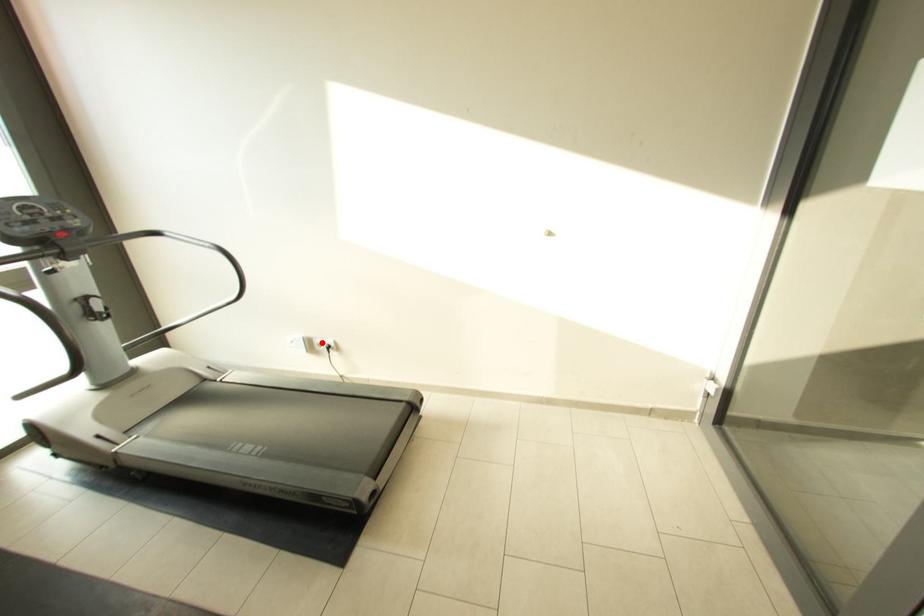
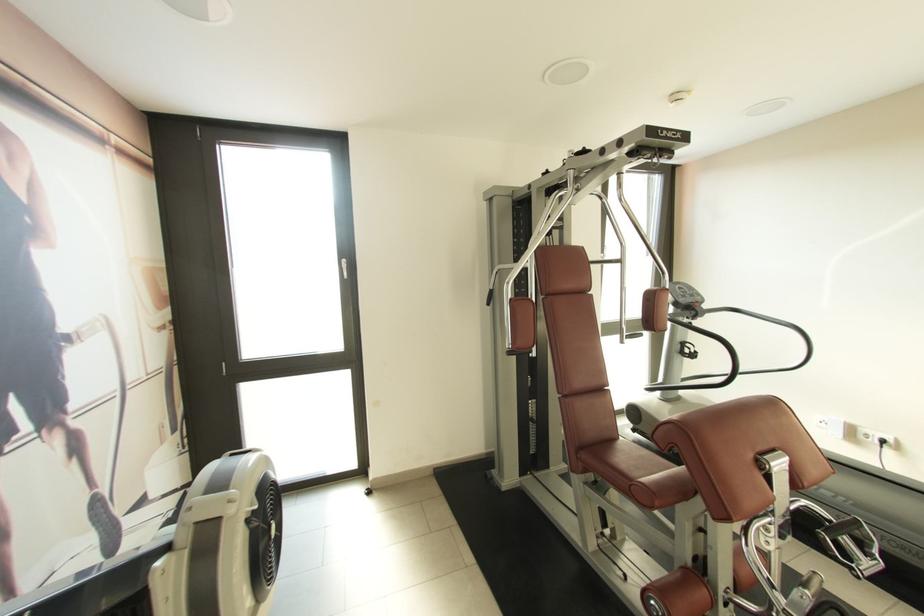
Where in the second image is the point corresponding to the highlighted location from the first image?

(868, 432)